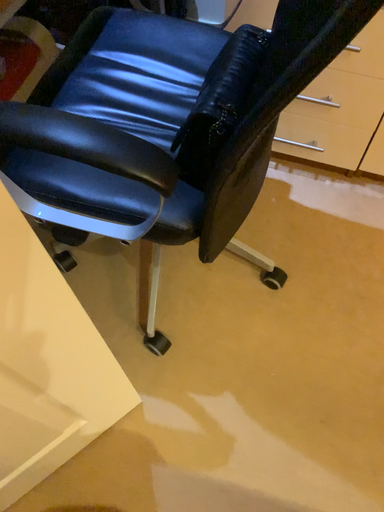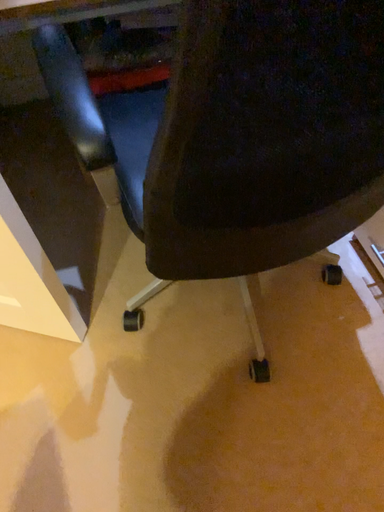
Question: How did the camera likely rotate when shooting the video?

Choices:
 (A) rotated right
 (B) rotated left

Answer: (B)